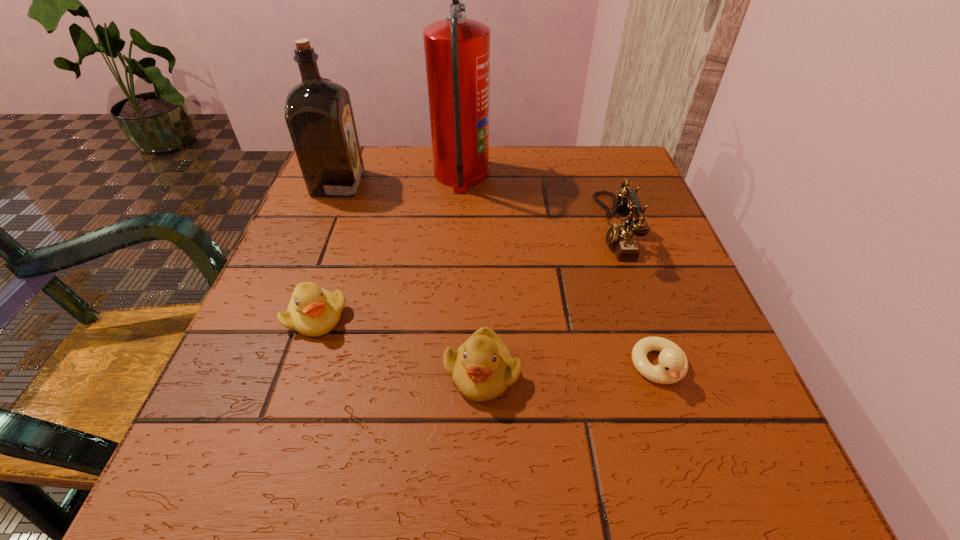
Find the location of a particular element. The height and width of the screenshot is (540, 960). vacant region between the liquor and the second duckling from right to left is located at coordinates (410, 278).

Identify the location of vacant space that is in between the second duckling from right to left and the fire extinguisher. (471, 274).

Identify the location of free space that is in between the fourth farthest object and the fire extinguisher. The image size is (960, 540). (389, 246).

Identify the location of vacant point located between the third tallest object and the tallest object. (537, 201).

Locate an element on the screen. free spot between the second duckling from left to right and the liquor is located at coordinates (410, 278).

Where is `free spot between the shortest object and the fire extinguisher`? free spot between the shortest object and the fire extinguisher is located at coordinates (560, 271).

The height and width of the screenshot is (540, 960). I want to click on empty space that is in between the leftmost duckling and the second tallest object, so [x=327, y=250].

Find the location of `free space between the shortest object and the fire extinguisher`. free space between the shortest object and the fire extinguisher is located at coordinates (560, 271).

Locate an element on the screen. The height and width of the screenshot is (540, 960). free space between the second duckling from right to left and the tallest object is located at coordinates (471, 274).

Locate which object is the fourth closest to the tallest object. Please provide its 2D coordinates. Your answer should be formatted as a tuple, i.e. [(x, y)], where the tuple contains the x and y coordinates of a point satisfying the conditions above.

[(482, 368)]